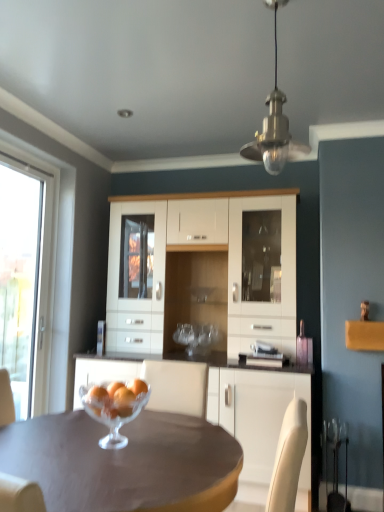
Identify the location of vacant area that lies to the right of clear glass bowl at center. The image size is (384, 512). (186, 440).